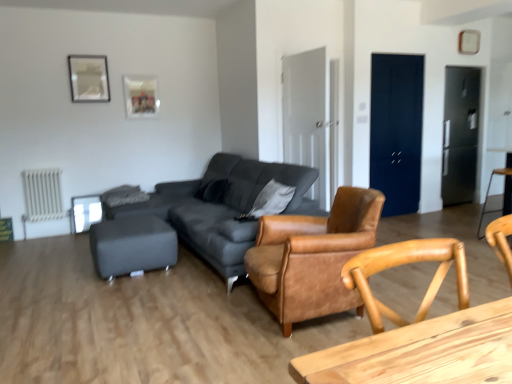
Measure the distance between point (123, 254) and camera.

Point (123, 254) and camera are 3.54 meters apart from each other.

What do you see at coordinates (85, 212) in the screenshot?
I see `white glossy side table at left` at bounding box center [85, 212].

What is the approximate width of wooden table at lower right?

20.51 inches.

The width and height of the screenshot is (512, 384). What do you see at coordinates (488, 196) in the screenshot?
I see `wooden bar stool at right, marked as the 2th bar stool in a left-to-right arrangement` at bounding box center [488, 196].

This screenshot has width=512, height=384. What are the coordinates of `black fabric pillow at center` in the screenshot? It's located at (213, 191).

Measure the distance between matte glass picture frame at upper center, the 2th picture frame viewed from the left, and camera.

matte glass picture frame at upper center, the 2th picture frame viewed from the left, and camera are 5.41 meters apart.

What is the approximate height of leather armchair at center?

leather armchair at center is 32.37 inches in height.

In order to click on matte gray ottoman at lower left, the first bar stool when ordered from left to right in this screenshot , I will do `click(132, 246)`.

Considering the relative positions of wooden table at lower right and white glossy side table at left in the image provided, is wooden table at lower right to the left or to the right of white glossy side table at left?

wooden table at lower right is to the right of white glossy side table at left.

Is wooden table at lower right situated inside white glossy side table at left or outside?

The correct answer is: outside.

Based on the photo, is wooden table at lower right looking in the opposite direction of white glossy side table at left?

Yes, wooden table at lower right is positioned with its back facing white glossy side table at left.

Can you confirm if wooden table at lower right is wider than white glossy side table at left?

Yes.

Is matte gray ottoman at lower left, acting as the 2th bar stool starting from the right, at the back of matte glass picture frame at upper center, the 2th picture frame viewed from the left?

No, matte glass picture frame at upper center, the 2th picture frame viewed from the left,'s orientation is not away from matte gray ottoman at lower left, acting as the 2th bar stool starting from the right.

Can you confirm if matte glass picture frame at upper center, the first picture frame viewed from the right, is positioned to the right of matte gray ottoman at lower left, the first bar stool when ordered from left to right?

No.

Is matte glass picture frame at upper center, marked as the 2th picture frame in a front-to-back arrangement, situated inside matte gray ottoman at lower left, acting as the 2th bar stool starting from the right, or outside?

matte glass picture frame at upper center, marked as the 2th picture frame in a front-to-back arrangement, lies outside matte gray ottoman at lower left, acting as the 2th bar stool starting from the right.

Which of these two, matte glass picture frame at upper center, the 2th picture frame viewed from the left, or matte gray ottoman at lower left, acting as the 2th bar stool starting from the right, is thinner?

Thinner between the two is matte glass picture frame at upper center, the 2th picture frame viewed from the left.

Which of these two, black fabric pillow at center or wooden bar stool at right, marked as the first bar stool in a right-to-left arrangement, is thinner?

black fabric pillow at center is thinner.

Find the location of a particular element. The image size is (512, 384). the 1st bar stool below when counting from the black fabric pillow at center (from the image's perspective) is located at coordinates (488, 196).

Considering the positions of objects black fabric pillow at center and wooden bar stool at right, marked as the 2th bar stool in a left-to-right arrangement, in the image provided, who is more to the right, black fabric pillow at center or wooden bar stool at right, marked as the 2th bar stool in a left-to-right arrangement,?

From the viewer's perspective, wooden bar stool at right, marked as the 2th bar stool in a left-to-right arrangement, appears more on the right side.

Would you say black fabric pillow at center is inside or outside wooden bar stool at right, marked as the 2th bar stool in a left-to-right arrangement?

black fabric pillow at center is spatially situated outside wooden bar stool at right, marked as the 2th bar stool in a left-to-right arrangement.

Considering their positions, is matte black couch at center located in front of or behind wooden bar stool at right, marked as the 2th bar stool in a left-to-right arrangement?

In the image, matte black couch at center appears in front of wooden bar stool at right, marked as the 2th bar stool in a left-to-right arrangement.

How far apart are matte black couch at center and wooden bar stool at right, marked as the 2th bar stool in a left-to-right arrangement?

They are 10.49 feet apart.

Consider the image. Does matte black couch at center have a lesser height compared to wooden bar stool at right, marked as the 2th bar stool in a left-to-right arrangement?

No.

At what (x,y) coordinates should I click in order to perform the action: click on studio couch that appears above the wooden bar stool at right, marked as the first bar stool in a right-to-left arrangement (from a real-world perspective). Please return your answer as a coordinate pair (x, y). The image size is (512, 384). Looking at the image, I should click on (196, 218).

From a real-world perspective, is matte glass picture frame at upper center, which is the 1th picture frame in back-to-front order, positioned under leather armchair at center based on gravity?

Incorrect, from a real-world perspective, matte glass picture frame at upper center, which is the 1th picture frame in back-to-front order, is higher than leather armchair at center.

Looking at this image, which is behind, matte glass picture frame at upper center, which is the 1th picture frame in back-to-front order, or leather armchair at center?

matte glass picture frame at upper center, which is the 1th picture frame in back-to-front order.

Which is more to the left, matte glass picture frame at upper center, which is the 1th picture frame in back-to-front order, or leather armchair at center?

From the viewer's perspective, matte glass picture frame at upper center, which is the 1th picture frame in back-to-front order, appears more on the left side.

Considering the sizes of objects matte glass picture frame at upper center, the first picture frame viewed from the right, and white glossy side table at left in the image provided, who is wider, matte glass picture frame at upper center, the first picture frame viewed from the right, or white glossy side table at left?

white glossy side table at left is wider.

Is point (127, 89) positioned after point (84, 228)?

Yes, point (127, 89) is behind point (84, 228).

In the image, there is a matte glass picture frame at upper center, which is the 1th picture frame in back-to-front order. At what (x,y) coordinates should I click in order to perform the action: click on side table below it (from a real-world perspective). Please return your answer as a coordinate pair (x, y). Looking at the image, I should click on (85, 212).

Considering the positions of objects wooden bar stool at right, marked as the 2th bar stool in a left-to-right arrangement, and white metallic radiator at lower left in the image provided, who is more to the left, wooden bar stool at right, marked as the 2th bar stool in a left-to-right arrangement, or white metallic radiator at lower left?

Positioned to the left is white metallic radiator at lower left.

Considering the relative sizes of wooden bar stool at right, marked as the first bar stool in a right-to-left arrangement, and white metallic radiator at lower left in the image provided, is wooden bar stool at right, marked as the first bar stool in a right-to-left arrangement, wider than white metallic radiator at lower left?

Yes, wooden bar stool at right, marked as the first bar stool in a right-to-left arrangement, is wider than white metallic radiator at lower left.

Consider the image. From the image's perspective, relative to white metallic radiator at lower left, is wooden bar stool at right, marked as the first bar stool in a right-to-left arrangement, above or below?

Based on their image positions, wooden bar stool at right, marked as the first bar stool in a right-to-left arrangement, is located above white metallic radiator at lower left.

Which is behind, point (493, 212) or point (50, 216)?

The point (50, 216) is farther.

The height and width of the screenshot is (384, 512). I want to click on side table directly beneath the wooden table at lower right (from a real-world perspective), so click(85, 212).

The width and height of the screenshot is (512, 384). In order to click on the 1st picture frame counting from the left of the matte gray ottoman at lower left, the first bar stool when ordered from left to right in this screenshot , I will do `click(140, 96)`.

In the scene shown: Based on their spatial positions, is wooden table at lower right or matte glass picture frame at upper center, the 2th picture frame viewed from the left, closer to black fabric pillow at center?

The object closer to black fabric pillow at center is matte glass picture frame at upper center, the 2th picture frame viewed from the left.

Considering their positions, is wooden table at lower right positioned further to metallic silver picture frame at upper left, the 1th picture frame from the front, than black fabric pillow at center?

Based on the image, wooden table at lower right appears to be further to metallic silver picture frame at upper left, the 1th picture frame from the front.

From the image, which object appears to be nearer to metallic silver picture frame at upper left, the second picture frame in the back-to-front sequence, white metallic radiator at lower left or matte black couch at center?

white metallic radiator at lower left.

When comparing their distances from matte glass picture frame at upper center, the 2th picture frame viewed from the left, does wooden table at lower right or white glossy side table at left seem closer?

Based on the image, white glossy side table at left appears to be nearer to matte glass picture frame at upper center, the 2th picture frame viewed from the left.

Estimate the real-world distances between objects in this image. Which object is closer to black fabric pillow at center, wooden table at lower right or wooden bar stool at right, marked as the 2th bar stool in a left-to-right arrangement?

wooden bar stool at right, marked as the 2th bar stool in a left-to-right arrangement.

Based on their spatial positions, is matte black couch at center or leather armchair at center further from white glossy side table at left?

leather armchair at center is further to white glossy side table at left.

Which object lies nearer to the anchor point white glossy side table at left, black fabric pillow at center or matte black couch at center?

black fabric pillow at center is positioned closer to the anchor white glossy side table at left.

When comparing their distances from matte glass picture frame at upper center, the first picture frame viewed from the right, does white glossy side table at left or white metallic radiator at lower left seem closer?

white glossy side table at left is positioned closer to the anchor matte glass picture frame at upper center, the first picture frame viewed from the right.

I want to click on radiator between wooden table at lower right and matte glass picture frame at upper center, marked as the 2th picture frame in a front-to-back arrangement, along the z-axis, so click(42, 195).

The image size is (512, 384). What are the coordinates of `picture frame between leather armchair at center and white glossy side table at left from front to back` in the screenshot? It's located at (89, 78).

Find the location of a particular element. The width and height of the screenshot is (512, 384). studio couch between matte gray ottoman at lower left, the first bar stool when ordered from left to right, and wooden bar stool at right, marked as the 2th bar stool in a left-to-right arrangement is located at coordinates (196, 218).

This screenshot has width=512, height=384. Find the location of `side table situated between white metallic radiator at lower left and wooden bar stool at right, marked as the first bar stool in a right-to-left arrangement, from left to right`. side table situated between white metallic radiator at lower left and wooden bar stool at right, marked as the first bar stool in a right-to-left arrangement, from left to right is located at coordinates (85, 212).